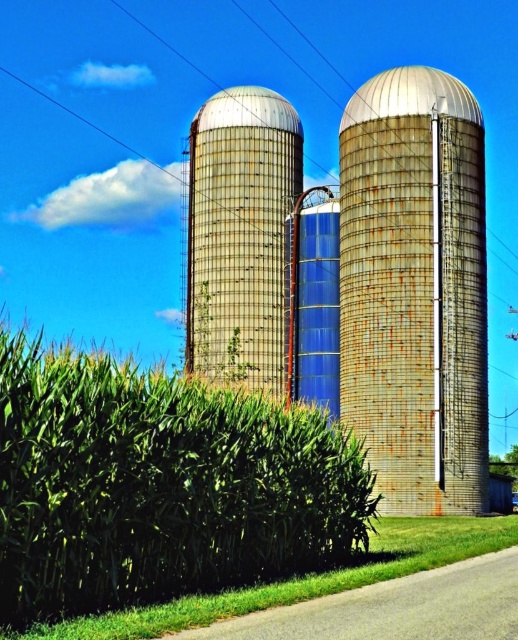
You are a maintenance worker needing to access the top of both silos. Which silo, the rusty metal silo at center or the rusty metallic silo at center, requires you to climb a ladder to reach its dome roof?

The rusty metal silo at center requires climbing a ladder to reach its dome roof because it is taller and narrower than the rusty metallic silo at center, which is shorter but wider.

Based on the photo, you are a farmer standing in a field looking at the green leafy corn at center and the rusty metallic silo at center. Which object is taller?

The rusty metallic silo at center is taller than the green leafy corn at center.